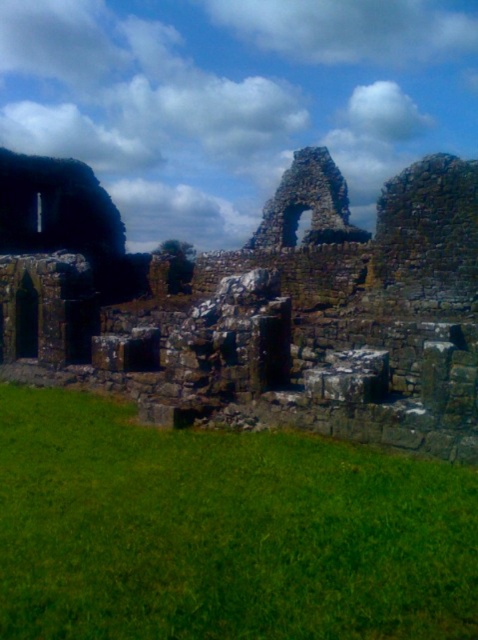
You are standing in the ruins and want to place a small garden decoration. You have two options to choose from. The first option is to place it on the green grass at lower center, and the second option is to place it on the rusty stone ruins at left. Which location is more accessible for placing the decoration?

The green grass at lower center is closer to the viewer than the rusty stone ruins at left, so placing the decoration on the green grass at lower center would be more accessible.

You are standing at the center of the ruins and want to find the green grass at lower center. According to the coordinates provided, where should you look relative to your position?

The green grass at lower center is located at coordinates point (223, 531), which means it is positioned to the lower right of your current position at the center of the ruins.